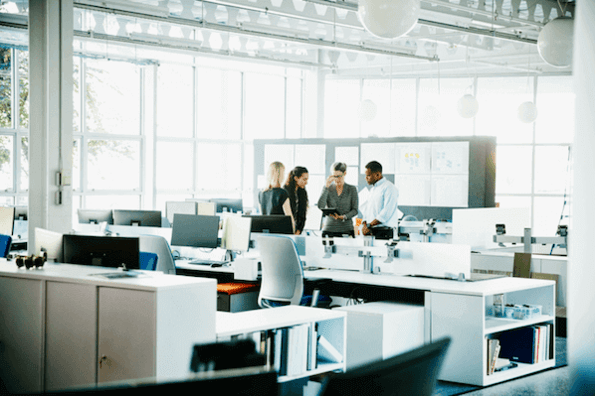
I want to click on window, so click(112, 175), click(12, 171), click(168, 171), click(217, 167), click(265, 124), click(347, 122), click(400, 117), click(443, 117), click(497, 120), click(558, 131).